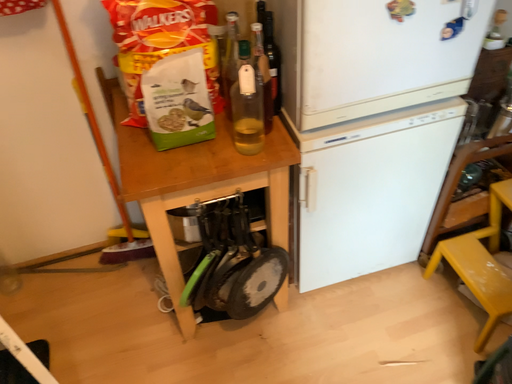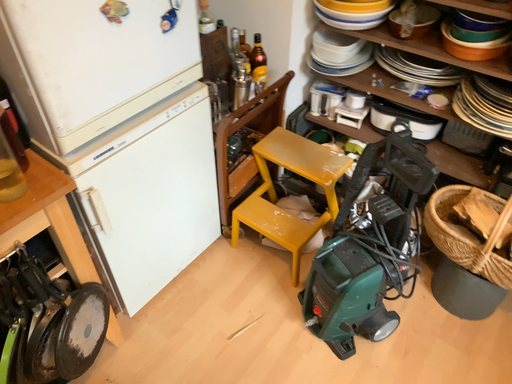
Question: Which way did the camera rotate in the video?

Choices:
 (A) rotated left
 (B) rotated right

Answer: (B)